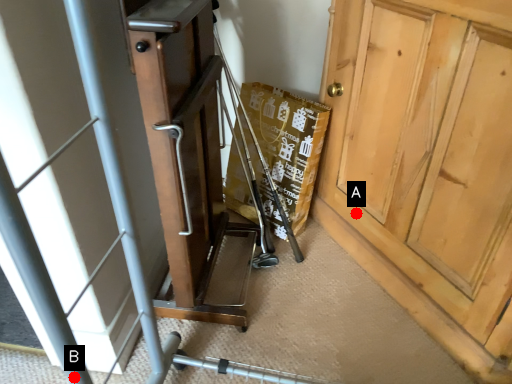
Question: Two points are circled on the image, labeled by A and B beside each circle. Which point is farther to the camera?

Choices:
 (A) A is further
 (B) B is further

Answer: (A)